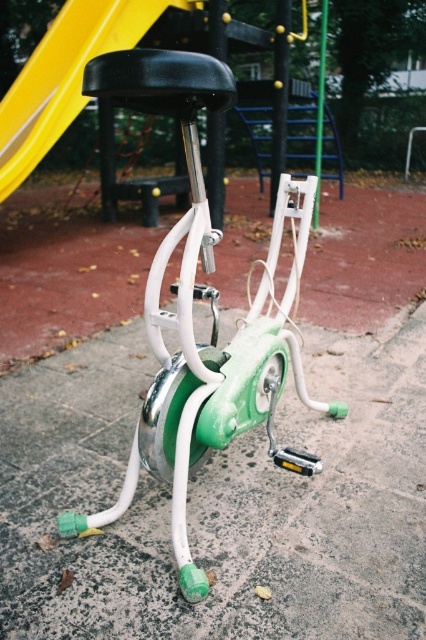
Question: Which of the following is the farthest from the observer?

Choices:
 (A) (268, 292)
 (B) (28, 161)
 (C) (336, 577)

Answer: (B)

Question: Is green rubber pavement at lower center smaller than black plastic slide at upper center?

Choices:
 (A) no
 (B) yes

Answer: (B)

Question: Among these points, which one is nearest to the camera?

Choices:
 (A) (141, 451)
 (B) (48, 118)

Answer: (A)

Question: Which of the following is the farthest from the observer?

Choices:
 (A) (181, 452)
 (B) (42, 509)
 (C) (63, 80)

Answer: (C)

Question: Is green rubber pavement at lower center thinner than black plastic slide at upper center?

Choices:
 (A) no
 (B) yes

Answer: (A)

Question: Can you confirm if green rubber pavement at lower center is smaller than black plastic slide at upper center?

Choices:
 (A) yes
 (B) no

Answer: (A)